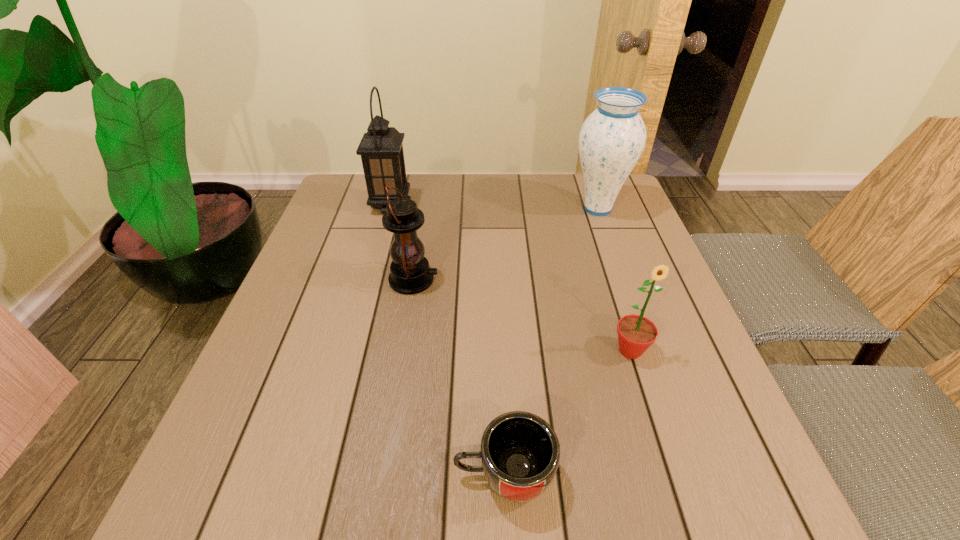
Find the location of `the farther lantern`. the farther lantern is located at coordinates pos(381,149).

Where is `vase`? vase is located at coordinates [x=611, y=141].

Where is `the shorter lantern`? the shorter lantern is located at coordinates (410, 273).

I want to click on the nearer lantern, so click(x=410, y=273).

Where is `sunflower`? sunflower is located at coordinates (636, 333).

Where is `mug`? The width and height of the screenshot is (960, 540). mug is located at coordinates (520, 452).

You are a GUI agent. You are given a task and a screenshot of the screen. Output one action in this format:
    pyautogui.click(x=<x>, y=<y>)
    Task: Click on the nearest object
    This screenshot has height=540, width=960.
    Given the screenshot: What is the action you would take?
    pyautogui.click(x=520, y=452)

Locate an element on the screen. The image size is (960, 540). vacant space situated 0.270m on the right of the taller lantern is located at coordinates (503, 206).

Find the location of a particular element. Image resolution: width=960 pixels, height=540 pixels. free space located 0.060m on the front of the vase is located at coordinates (609, 239).

Locate several spots within the vacant area situated above the shorter lantern, indicating its light source. Please provide its 2D coordinates. Your answer should be formatted as a tuple, i.e. [(x, y)], where the tuple contains the x and y coordinates of a point satisfying the conditions above.

[(593, 280)]